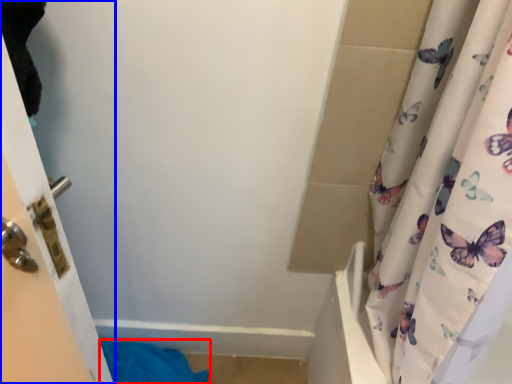
Question: Which of the following is the farthest to the observer, bath towel (highlighted by a red box) or door (highlighted by a blue box)?

Choices:
 (A) bath towel
 (B) door

Answer: (A)